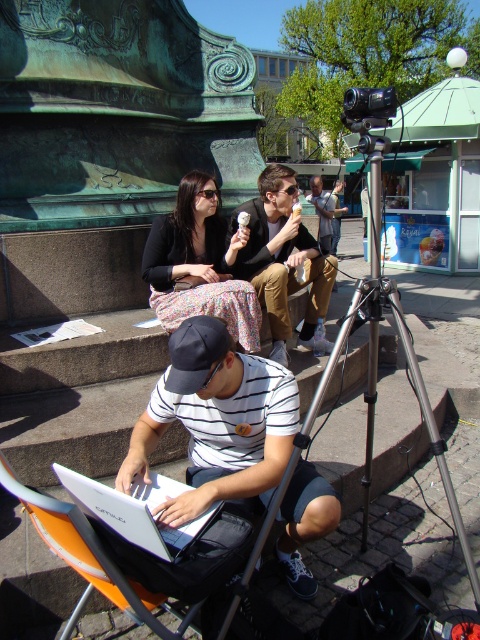
You are a photographer who wants to set up a camera on the silver metallic tripod at center. However, you notice the matte brown jacket at center might block the view. Based on the scene description, will the jacket obstruct the camera view when mounted on the tripod?

The silver metallic tripod at center is taller than the matte brown jacket at center, so the camera mounted on the tripod will be above the jacket, avoiding any obstruction.

You are standing in the outdoor scene and want to find the white striped shirt at center. Based on the coordinates provided in the description, can you determine its position relative to the other objects in the scene?

The white striped shirt at center is located at coordinates point (216, 420), which places it centrally within the scene, likely positioned between the man on the orange chair and the two people sitting on the stone steps behind him.